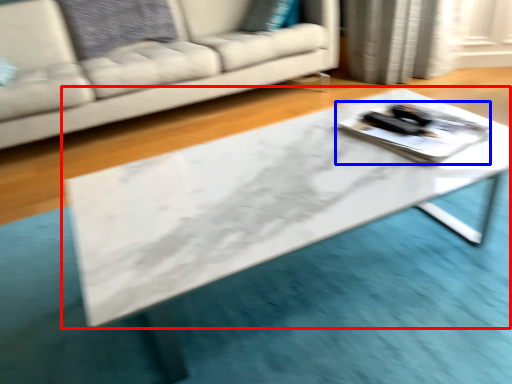
Question: Which of the following is the closest to the observer, table (highlighted by a red box) or tray (highlighted by a blue box)?

Choices:
 (A) table
 (B) tray

Answer: (A)